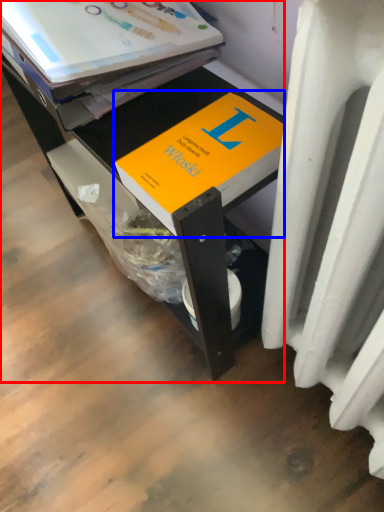
Question: Which of the following is the closest to the observer, desk (highlighted by a red box) or book (highlighted by a blue box)?

Choices:
 (A) desk
 (B) book

Answer: (A)